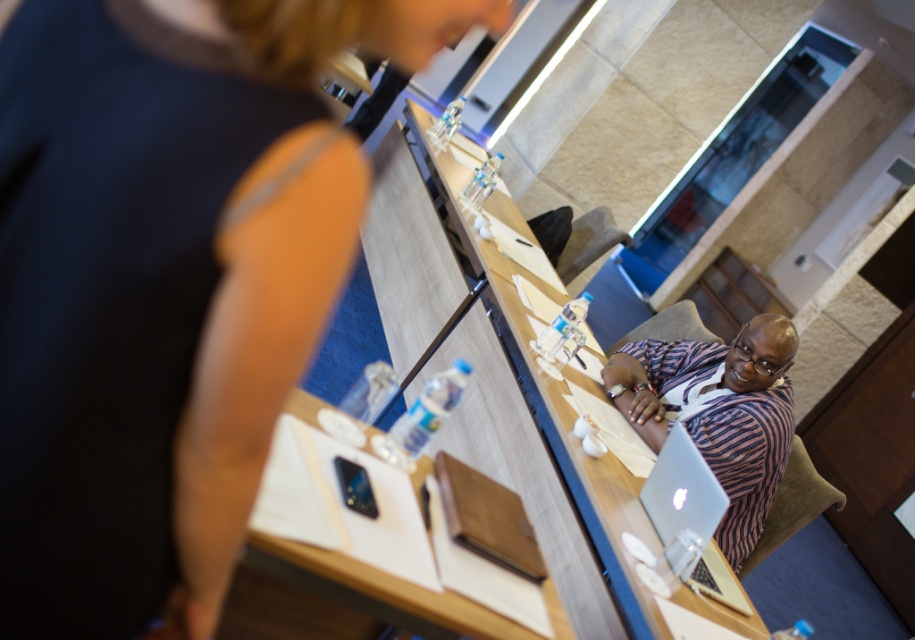
Question: Which point is farther to the camera?

Choices:
 (A) wooden table at center
 (B) silver metallic laptop at center

Answer: (B)

Question: Does matte black shirt at upper left have a smaller size compared to silver metallic laptop at center?

Choices:
 (A) no
 (B) yes

Answer: (A)

Question: Among these objects, which one is farthest from the camera?

Choices:
 (A) matte black shirt at upper left
 (B) wooden table at center
 (C) silver metallic laptop at center

Answer: (C)

Question: Can you confirm if wooden table at center is positioned to the right of silver metallic laptop at center?

Choices:
 (A) no
 (B) yes

Answer: (A)

Question: Which point is closer to the camera?

Choices:
 (A) striped fabric shirt at center
 (B) wooden table at center

Answer: (B)

Question: Does matte black shirt at upper left have a smaller size compared to silver metallic laptop at center?

Choices:
 (A) no
 (B) yes

Answer: (A)